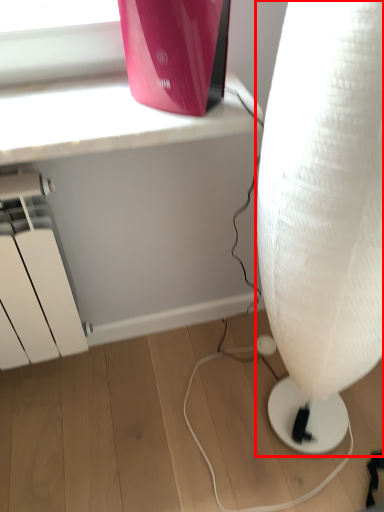
Question: Observing the image, what is the correct spatial positioning of lamp (annotated by the red box) in reference to appliance?

Choices:
 (A) left
 (B) right

Answer: (B)